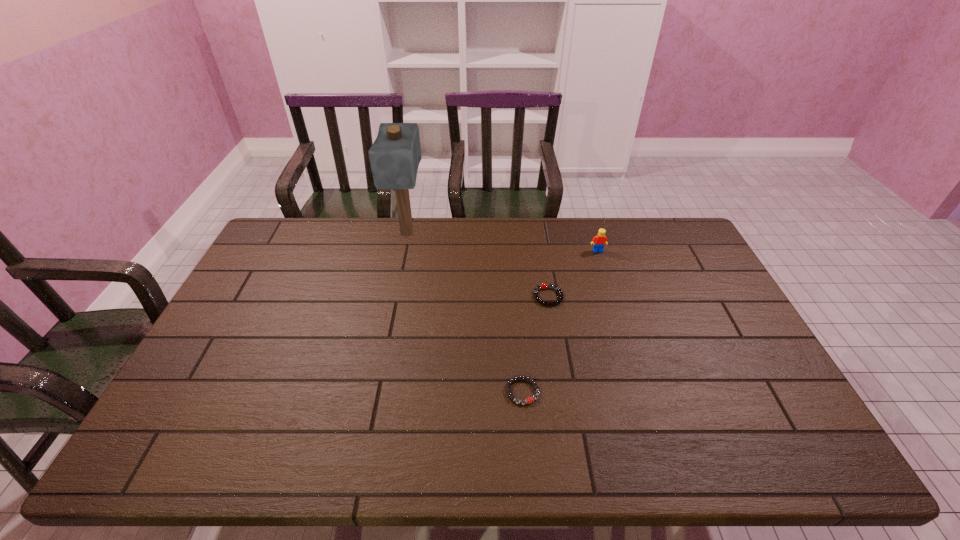
You are a GUI agent. You are given a task and a screenshot of the screen. Output one action in this format:
    pyautogui.click(x=<x>, y=<y>)
    Task: Click on the vacant area situated on the back of the third object from left to right
    
    Given the screenshot: What is the action you would take?
    pyautogui.click(x=536, y=217)

You are a GUI agent. You are given a task and a screenshot of the screen. Output one action in this format:
    pyautogui.click(x=<x>, y=<y>)
    Task: Click on the vacant space located on the right of the nearest object
    
    Given the screenshot: What is the action you would take?
    pyautogui.click(x=684, y=392)

This screenshot has width=960, height=540. What are the coordinates of `mallet that is at the far edge` in the screenshot? It's located at (395, 155).

At what (x,y) coordinates should I click in order to perform the action: click on Lego situated at the far edge. Please return your answer as a coordinate pair (x, y). Looking at the image, I should click on (600, 240).

In the image, there is a desktop. At what (x,y) coordinates should I click in order to perform the action: click on vacant space at the far edge. Please return your answer as a coordinate pair (x, y). Looking at the image, I should click on (426, 240).

Image resolution: width=960 pixels, height=540 pixels. In the image, there is a desktop. In order to click on free space at the near edge in this screenshot , I will do `click(372, 435)`.

Locate an element on the screen. The width and height of the screenshot is (960, 540). vacant space at the left edge is located at coordinates (276, 292).

Find the location of `free spot at the right edge of the desktop`. free spot at the right edge of the desktop is located at coordinates pos(719,303).

In the image, there is a desktop. Identify the location of vacant space at the far left corner. This screenshot has width=960, height=540. (285, 247).

Where is `vacant space at the far right corner of the desktop`? This screenshot has width=960, height=540. vacant space at the far right corner of the desktop is located at coordinates (653, 236).